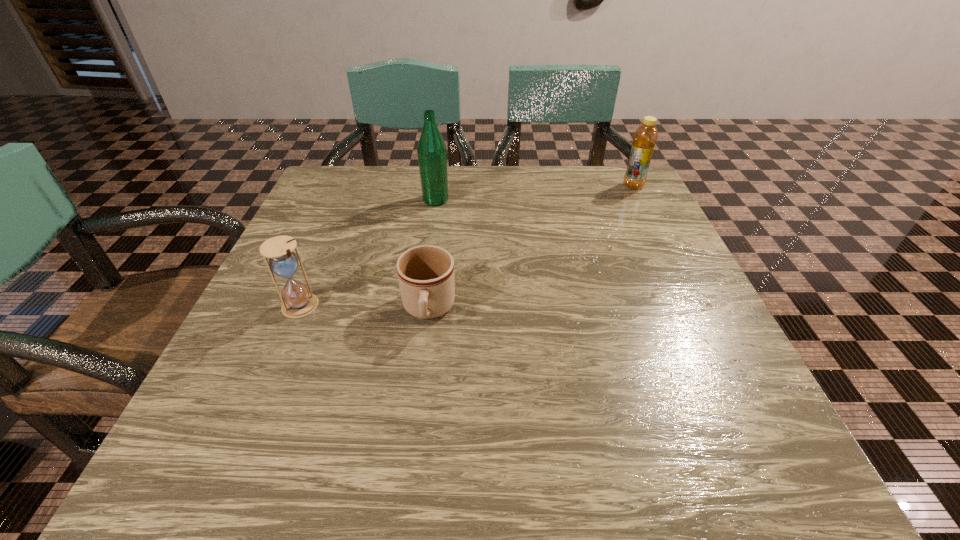
Locate an element on the screen. The height and width of the screenshot is (540, 960). unoccupied area between the farthest object and the nearer bottle is located at coordinates (535, 193).

Identify the location of free spot between the second farthest object and the farther bottle. Image resolution: width=960 pixels, height=540 pixels. (535, 193).

At what (x,y) coordinates should I click in order to perform the action: click on unoccupied area between the mug and the leftmost object. Please return your answer as a coordinate pair (x, y). This screenshot has height=540, width=960. Looking at the image, I should click on (365, 308).

At what (x,y) coordinates should I click in order to perform the action: click on free point between the shorter bottle and the taller bottle. Please return your answer as a coordinate pair (x, y). Image resolution: width=960 pixels, height=540 pixels. Looking at the image, I should click on (535, 193).

The height and width of the screenshot is (540, 960). What are the coordinates of `vacant space in between the mug and the hourglass` in the screenshot? It's located at (365, 308).

Identify the location of free point between the mug and the right bottle. The image size is (960, 540). (531, 248).

Identify the location of free space between the mug and the farther bottle. The width and height of the screenshot is (960, 540). (531, 248).

Where is `free spot between the hourglass and the tallest object`? Image resolution: width=960 pixels, height=540 pixels. free spot between the hourglass and the tallest object is located at coordinates (368, 253).

Locate which object ranks second in proximity to the hourglass. Please provide its 2D coordinates. Your answer should be formatted as a tuple, i.e. [(x, y)], where the tuple contains the x and y coordinates of a point satisfying the conditions above.

[(432, 153)]

Select which object appears as the closest to the right bottle. Please provide its 2D coordinates. Your answer should be formatted as a tuple, i.e. [(x, y)], where the tuple contains the x and y coordinates of a point satisfying the conditions above.

[(432, 153)]